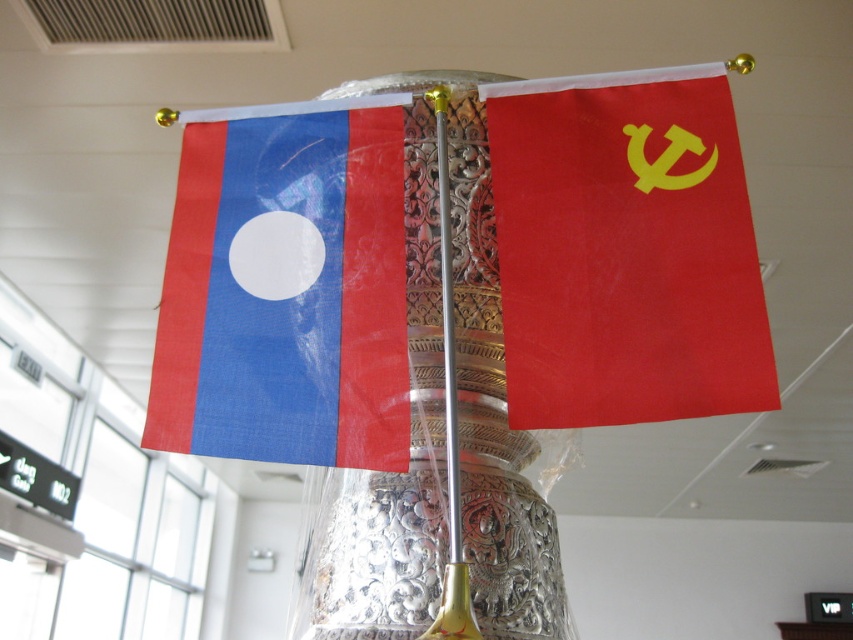
You are standing in front of the decorative metallic pole with two flags. There are two points marked on the pole at coordinates point [514,282] and point [360,536]. Which point is closer to you?

Point [514,282] is in front of point [360,536], so the point closer to you is point [514,282].

You are arranging flowers in a silver metallic vase at center. You have a matte fabric flag at left nearby. If you want to place the flag so it is not blocking the vase, where should you position it relative to the vase?

The matte fabric flag at left has a smaller size compared to silver metallic vase at center. To prevent blocking the vase, position the flag behind the vase since it is smaller and less likely to obscure the view.